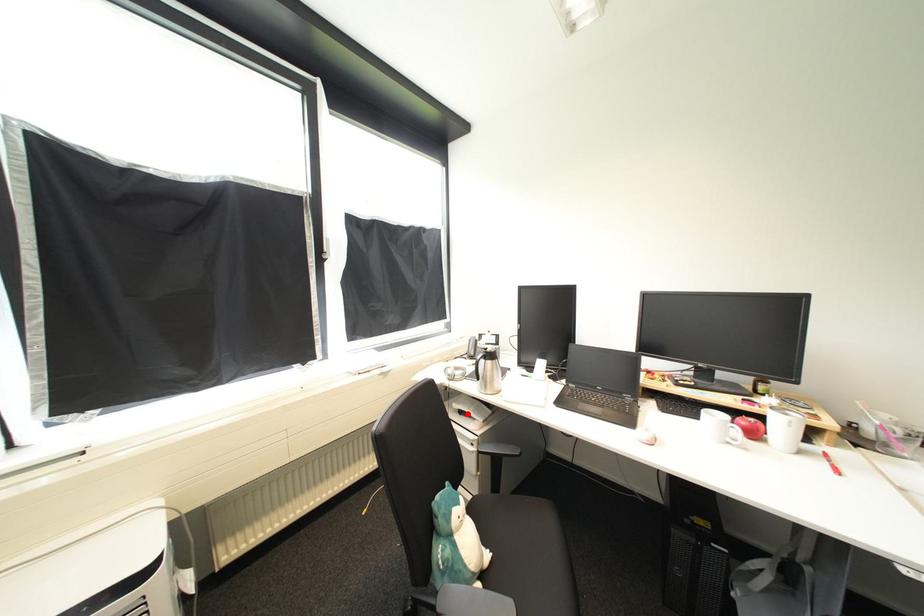
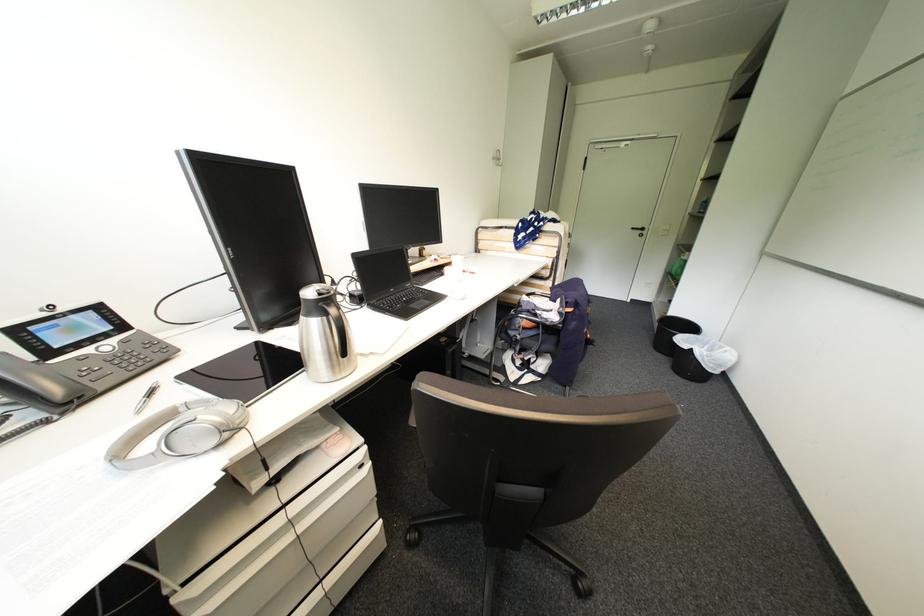
Question: I am providing you with two images of the same scene from different viewpoints. Given a red point in image1, look at the same physical point in image2. Is it:

Choices:
 (A) Closer to the viewpoint
 (B) Farther from the viewpoint

Answer: (A)